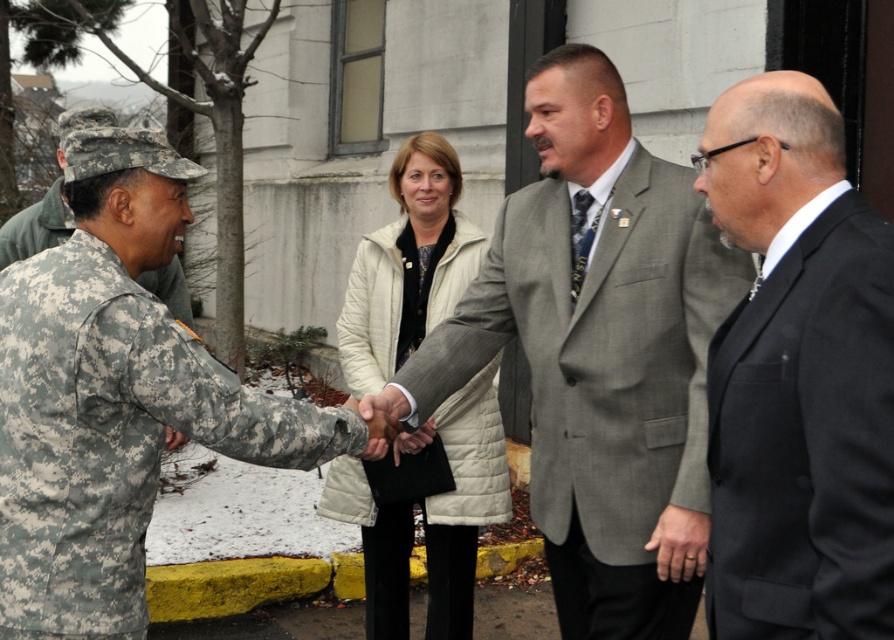
Which is in front, point (567, 563) or point (342, 442)?

Positioned in front is point (342, 442).

Is gray textured suit at center wider than camouflage fabric uniform at left?

Correct, the width of gray textured suit at center exceeds that of camouflage fabric uniform at left.

This screenshot has height=640, width=894. I want to click on gray textured suit at center, so click(x=597, y=353).

Between camouflage fabric uniform at left and light beige quilted jacket at center, which one has less height?

light beige quilted jacket at center

Between camouflage fabric uniform at left and light beige quilted jacket at center, which one appears on the right side from the viewer's perspective?

Positioned to the right is light beige quilted jacket at center.

Which is in front, point (133, 289) or point (330, 506)?

Point (133, 289) is more forward.

Find the location of `camouflage fabric uniform at left`. camouflage fabric uniform at left is located at coordinates (114, 396).

Between point (727, 371) and point (355, 481), which one is positioned in front?

Point (727, 371)

Between point (841, 364) and point (399, 205), which one is positioned behind?

The point (399, 205) is more distant.

At what (x,y) coordinates should I click in order to perform the action: click on black matte suit at right. Please return your answer as a coordinate pair (x, y). Image resolution: width=894 pixels, height=640 pixels. Looking at the image, I should click on (798, 376).